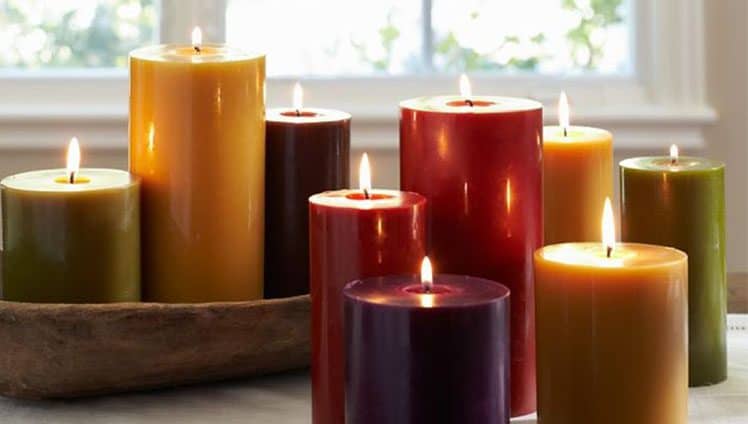
Identify the location of candles. The width and height of the screenshot is (748, 424). (73, 239), (188, 180), (297, 150), (325, 258), (482, 192), (567, 190), (663, 206), (625, 323), (470, 343).